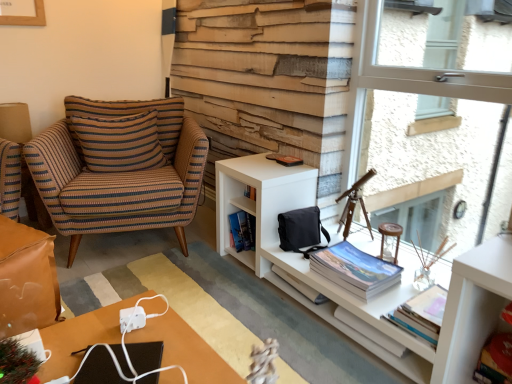
Question: Is white paper book at center, the 3th book positioned from the left, spatially inside white matte cabinet at right, or outside of it?

Choices:
 (A) outside
 (B) inside

Answer: (B)

Question: From a real-world perspective, relative to white matte cabinet at right, is white paper book at center, which appears as the 2th book when viewed from the right, vertically above or below?

Choices:
 (A) above
 (B) below

Answer: (B)

Question: Which object is positioned closest to the white matte cabinet at right?

Choices:
 (A) matte black desk at lower left
 (B) transparent glass window at upper right
 (C) white paper book at center, the 3th book positioned from the left
 (D) brown leather table at lower left
 (E) hardcover book at lower right, which is counted as the 4th book, starting from the left

Answer: (C)

Question: Which is farther from the white matte cabinet at right?

Choices:
 (A) green matte christmas tree at lower left
 (B) transparent glass window at upper right
 (C) hardcover book at center, the 1th book positioned from the left
 (D) hardcover book at lower right, which is counted as the 4th book, starting from the left
 (E) matte black desk at lower left

Answer: (A)